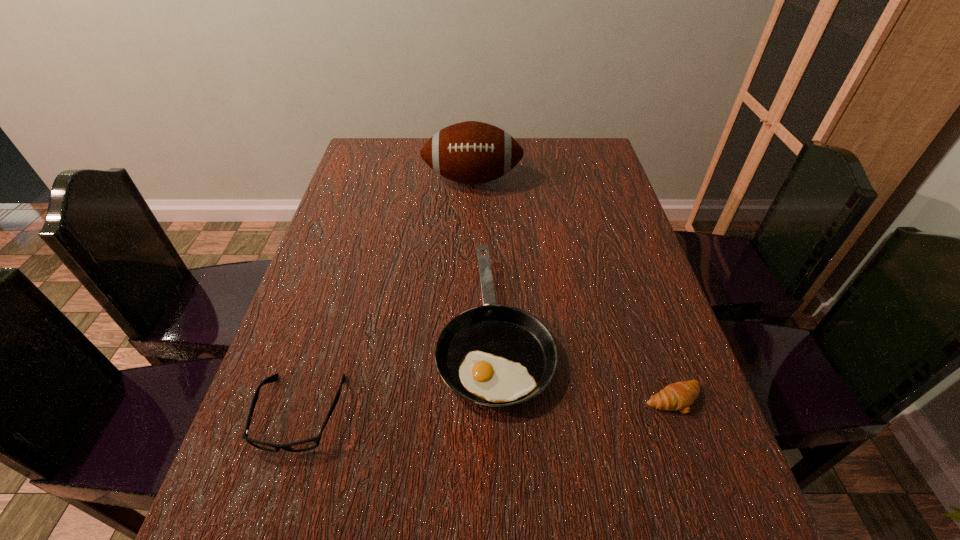
Identify the location of free space between the shortest object and the leftmost object. (487, 407).

Image resolution: width=960 pixels, height=540 pixels. Identify the location of free space between the second shortest object and the crescent roll. (487, 407).

At what (x,y) coordinates should I click in order to perform the action: click on free spot between the rightmost object and the frying pan. Please return your answer as a coordinate pair (x, y). Image resolution: width=960 pixels, height=540 pixels. Looking at the image, I should click on (585, 363).

The image size is (960, 540). I want to click on vacant space in between the frying pan and the farthest object, so click(484, 253).

The image size is (960, 540). What are the coordinates of `vacant area between the rightmost object and the farthest object` in the screenshot? It's located at (573, 289).

Find the location of a particular element. The image size is (960, 540). empty space between the crescent roll and the spectacles is located at coordinates (487, 407).

Where is `vacant area that lies between the rightmost object and the frying pan`? Image resolution: width=960 pixels, height=540 pixels. vacant area that lies between the rightmost object and the frying pan is located at coordinates (585, 363).

Locate an element on the screen. This screenshot has width=960, height=540. vacant area between the shortest object and the second tallest object is located at coordinates (585, 363).

Locate which object ranks in proximity to the farthest object. Please provide its 2D coordinates. Your answer should be formatted as a tuple, i.e. [(x, y)], where the tuple contains the x and y coordinates of a point satisfying the conditions above.

[(493, 355)]

Select which object is the second closest to the rightmost object. Please provide its 2D coordinates. Your answer should be formatted as a tuple, i.e. [(x, y)], where the tuple contains the x and y coordinates of a point satisfying the conditions above.

[(300, 446)]